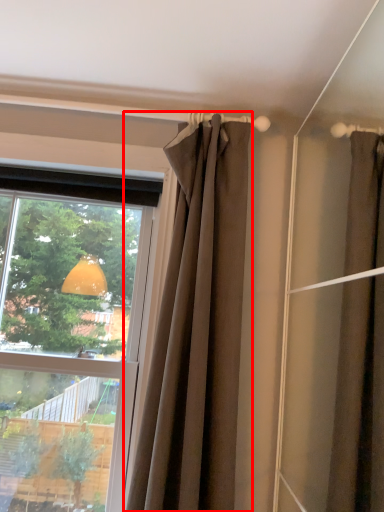
Question: Where is curtain (annotated by the red box) located in relation to window in the image?

Choices:
 (A) right
 (B) left

Answer: (A)